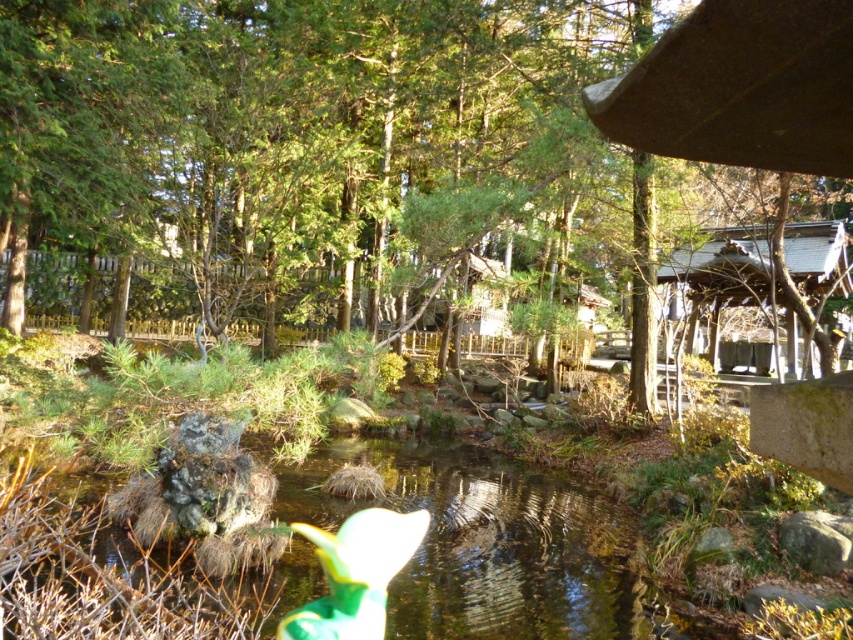
Question: Based on their relative distances, which object is farther from the green fabric toy at lower center?

Choices:
 (A) clear water at center
 (B) wooden cabin at right

Answer: (B)

Question: Is green leafy tree at center wider than wooden cabin at right?

Choices:
 (A) no
 (B) yes

Answer: (B)

Question: Which of the following is the farthest from the observer?

Choices:
 (A) clear water at center
 (B) green fabric toy at lower center
 (C) wooden cabin at right
 (D) green leafy tree at center

Answer: (C)

Question: Observing the image, what is the correct spatial positioning of clear water at center in reference to green fabric toy at lower center?

Choices:
 (A) above
 (B) below

Answer: (B)

Question: Which point is farther from the camera taking this photo?

Choices:
 (A) (676, 54)
 (B) (347, 518)

Answer: (B)

Question: In this image, where is green leafy tree at center located relative to green fabric toy at lower center?

Choices:
 (A) right
 (B) left

Answer: (B)